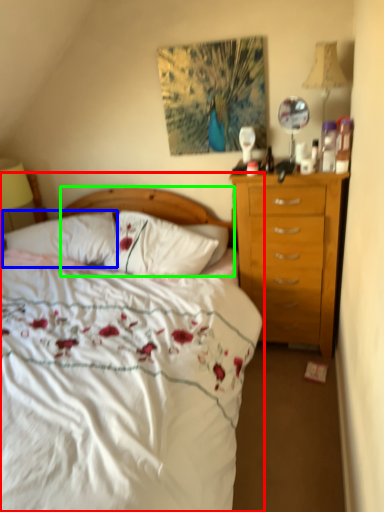
Question: Which is nearer to the bed (highlighted by a red box)? pillow (highlighted by a blue box) or headboard (highlighted by a green box).

Choices:
 (A) pillow
 (B) headboard

Answer: (A)